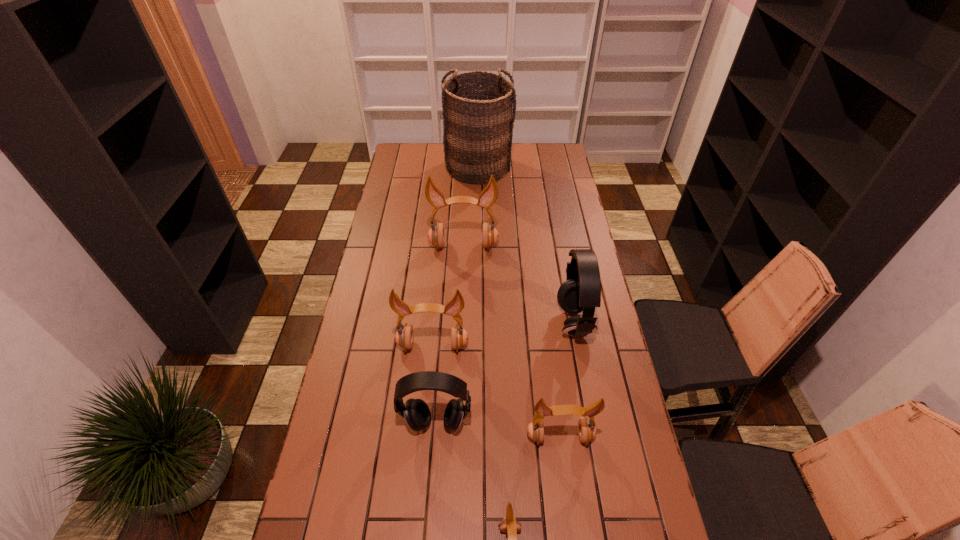
Select which earphone is the fourth closest to the smallest brown earphone. Please provide its 2D coordinates. Your answer should be formatted as a tuple, i.e. [(x, y)], where the tuple contains the x and y coordinates of a point satisfying the conditions above.

[(581, 291)]

Locate an element on the screen. The width and height of the screenshot is (960, 540). the third closest brown earphone to the second farthest brown earphone is located at coordinates pos(509,524).

Locate an element on the screen. brown earphone that stands as the second closest to the rightmost brown earphone is located at coordinates (404, 336).

This screenshot has height=540, width=960. I want to click on the second closest black earphone relative to the third smallest brown earphone, so click(581, 291).

I want to click on free space that satisfies the following two spatial constraints: 1. on the ear cups of the right black earphone; 2. on the ear cups of the smaller black earphone, so click(592, 423).

Find the location of a particular element. This screenshot has height=540, width=960. vacant region that satisfies the following two spatial constraints: 1. on the ear cups of the farther black earphone; 2. on the front-facing side of the third smallest brown earphone is located at coordinates (578, 346).

The width and height of the screenshot is (960, 540). What are the coordinates of `free spot that satisfies the following two spatial constraints: 1. on the ear cups of the bigger black earphone; 2. on the ear cups of the smaller black earphone` in the screenshot? It's located at (592, 423).